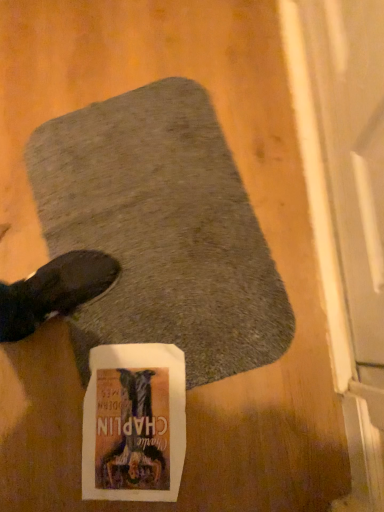
At what (x,y) coordinates should I click in order to perform the action: click on free space in front of gray soft rug at center. Please return your answer as a coordinate pair (x, y). The width and height of the screenshot is (384, 512). Looking at the image, I should click on (227, 433).